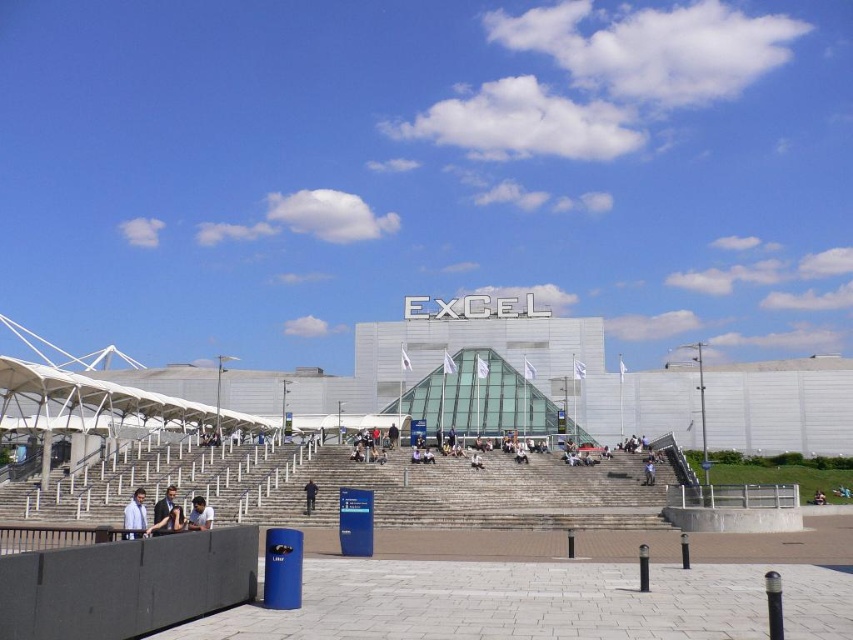
You are standing in front of the Excel Centre and see a dark blue fabric at center and a blue fabric person at center. Which object is covering the other one?

The dark blue fabric at center is positioned over the blue fabric person at center, so the dark blue fabric is covering the person.

From the picture: You are standing at the bottom of the wide staircase leading to the Excel Centre entrance. You notice two items at the center of the scene. One is the dark blue fabric at center and the other is the blue fabric person at center. Which one is closer to you?

The dark blue fabric at center is closer to you because it is in front of the blue fabric person at center.

You are standing at the base of the gray concrete stairs at center and want to place a dark blue fabric at center nearby. Considering the height difference between them, which object is taller?

The gray concrete stairs at center are much taller than the dark blue fabric at center according to the description.